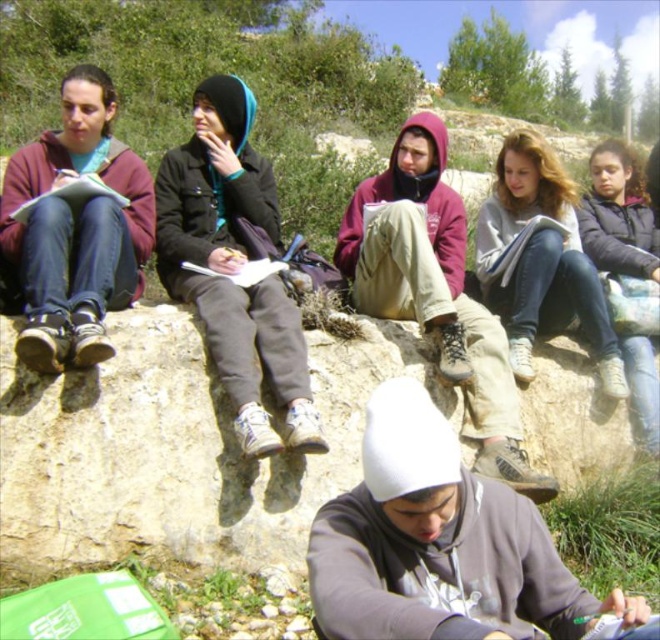
Does gray hoodie at center appear under dark gray hoodie at upper right?

Incorrect, gray hoodie at center is not positioned below dark gray hoodie at upper right.

Is gray hoodie at center wider than dark gray hoodie at upper right?

In fact, gray hoodie at center might be narrower than dark gray hoodie at upper right.

Who is more forward, (535,252) or (640,339)?

Point (535,252) is more forward.

This screenshot has height=640, width=660. Identify the location of gray hoodie at center. (541, 259).

Is brown rough rock at center shorter than maroon hoodie at center?

Incorrect, brown rough rock at center's height does not fall short of maroon hoodie at center's.

Is point (38, 488) closer to viewer compared to point (504, 413)?

That is True.

Identify the location of brown rough rock at center. The width and height of the screenshot is (660, 640). tap(176, 449).

Can you confirm if brown rough rock at center is smaller than dark gray hoodie at upper right?

Yes, brown rough rock at center is smaller than dark gray hoodie at upper right.

Based on the photo, measure the distance between point (117, 388) and camera.

Point (117, 388) and camera are 6.58 meters apart from each other.

The width and height of the screenshot is (660, 640). Identify the location of brown rough rock at center. (176, 449).